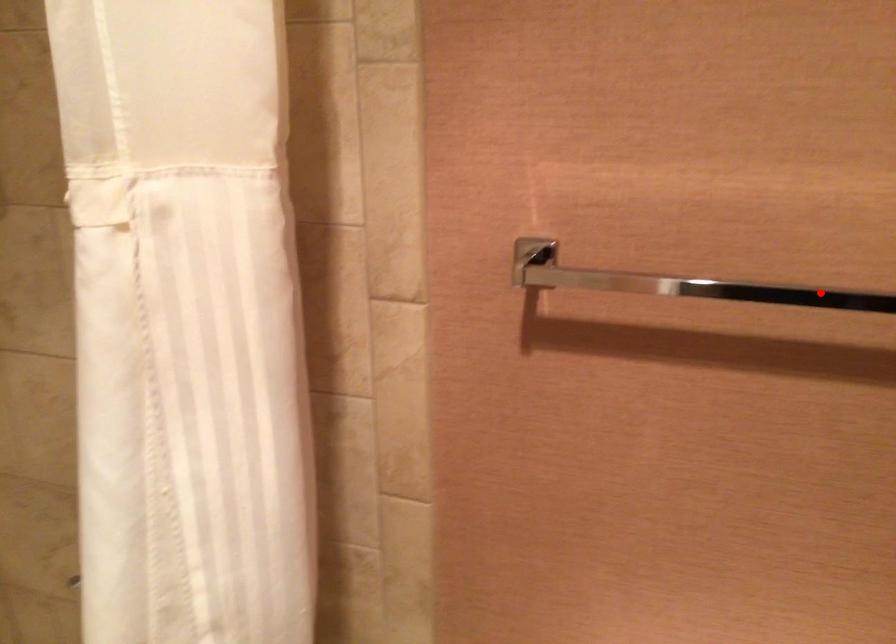
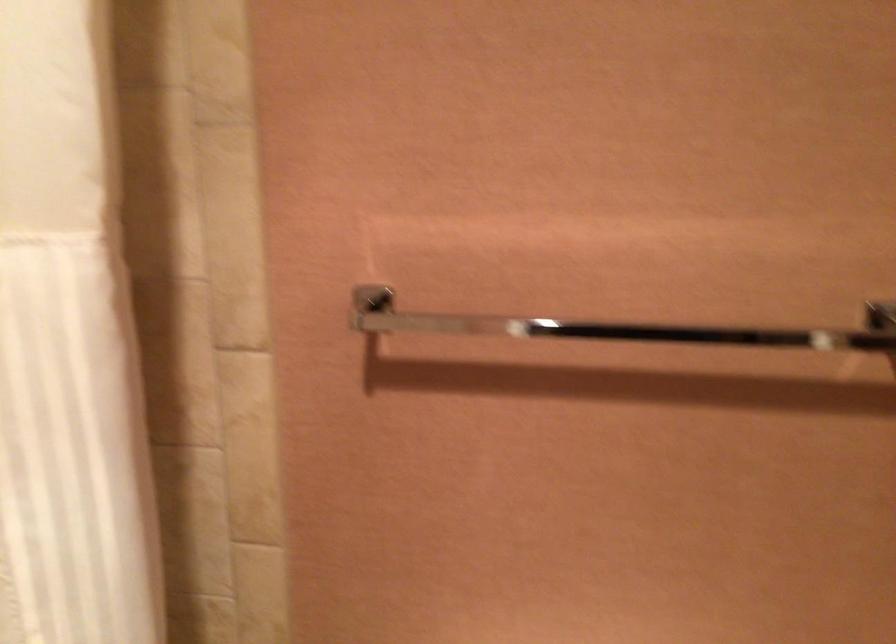
Locate, in the second image, the point that corresponds to the highlighted location in the first image.

(616, 327)